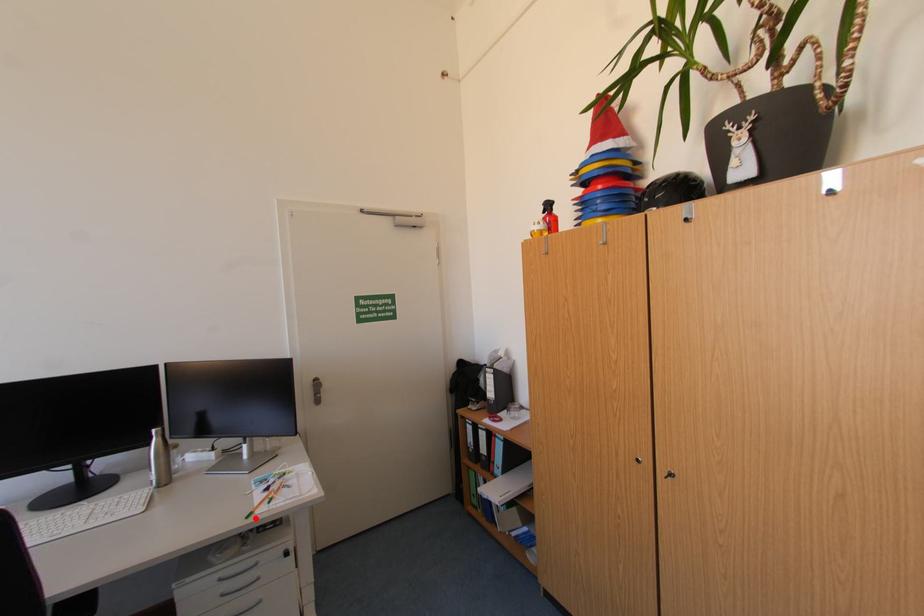
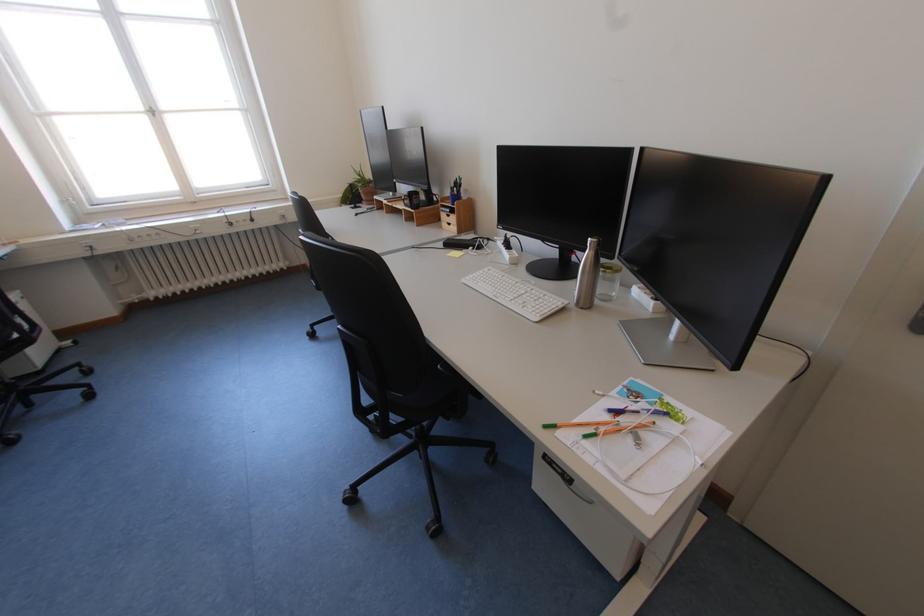
Question: I am providing you with two images of the same scene from different viewpoints. A red point is marked on the first image. At the location where the point appears in image 1, is it still visible in image 2?

Choices:
 (A) Yes
 (B) No

Answer: (A)